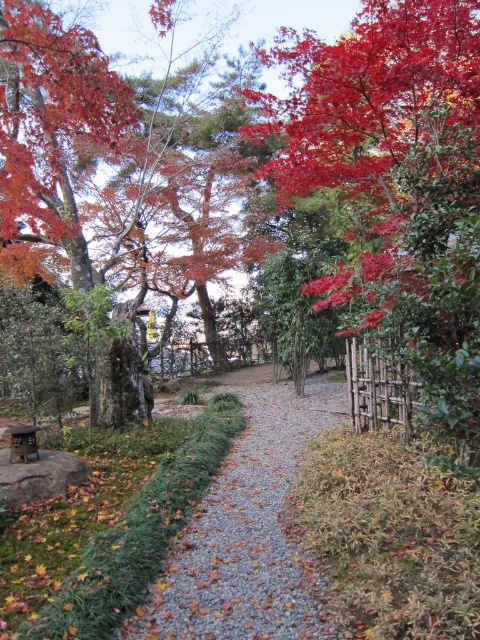
You are planning to set up a small garden event and need to place a 2 meter long table. You have a brown wooden picnic table at lower left. Can you place it along the gray gravel path at center without overlapping?

The gray gravel path at center is positioned on the right side of the brown wooden picnic table at lower left, so placing the table along the path would require checking the path width. Since the path is at the center and the table is at the lower left, there might be sufficient space along the path to accommodate the 2 meter table without overlapping, provided the path width allows it.

You are planning to place a small potted plant on the brown wooden picnic table at lower left. Considering the height of the gray gravel path at center and the table, will the plant be visible from above the path?

The gray gravel path at center is taller than the brown wooden picnic table at lower left, so the plant placed on the table will not be visible from above the path because the path is higher.

You are planning to walk along the gray gravel path at center in the garden. To your left, there is a brown wooden picnic table at lower left. Based on the scene, can you determine if the picnic table is positioned above or below the path?

The gray gravel path at center is located below the brown wooden picnic table at lower left, so the picnic table is positioned above the path.